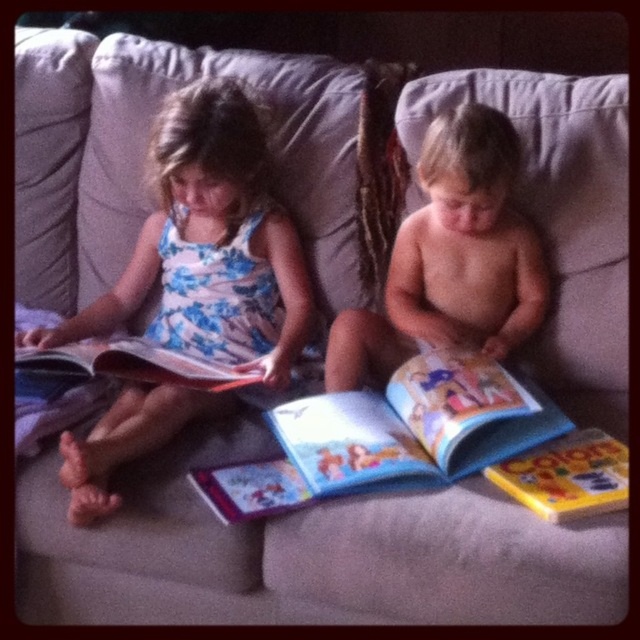
This screenshot has height=640, width=640. What do you see at coordinates (451, 259) in the screenshot? I see `smooth skin baby at center` at bounding box center [451, 259].

From the picture: Can you confirm if smooth skin baby at center is thinner than hardcover book at center?

Correct, smooth skin baby at center's width is less than hardcover book at center's.

At what (x,y) coordinates should I click in order to perform the action: click on smooth skin baby at center. Please return your answer as a coordinate pair (x, y). The width and height of the screenshot is (640, 640). Looking at the image, I should click on (451, 259).

The height and width of the screenshot is (640, 640). In order to click on smooth skin baby at center in this screenshot , I will do `click(451, 259)`.

Does floral dress at left appear under hardcover book at center?

No, floral dress at left is not below hardcover book at center.

Does floral dress at left have a larger size compared to hardcover book at center?

Yes.

The height and width of the screenshot is (640, 640). Identify the location of floral dress at left. (211, 244).

Looking at this image, is hardcover book at center further to the viewer compared to hardcover book at left?

No.

Can you confirm if hardcover book at center is positioned to the left of hardcover book at left?

Incorrect, hardcover book at center is not on the left side of hardcover book at left.

Who is more forward, (429, 451) or (211, 378)?

Point (429, 451) is in front.

You are a GUI agent. You are given a task and a screenshot of the screen. Output one action in this format:
    pyautogui.click(x=<x>, y=<y>)
    Task: Click on the hardcover book at center
    This screenshot has width=640, height=640.
    Given the screenshot: What is the action you would take?
    pyautogui.click(x=388, y=436)